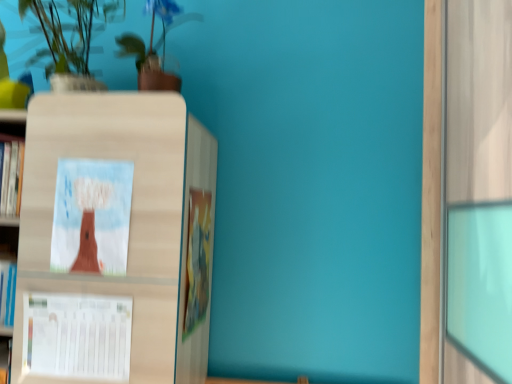
Question: In which direction should I rotate to look at green matte plant at upper center, arranged as the second houseplant when viewed from the left?

Choices:
 (A) right
 (B) left

Answer: (B)

Question: Is green matte plant at upper left, which is counted as the second houseplant, starting from the right, closer to camera compared to green matte plant at upper center, arranged as the second houseplant when viewed from the left?

Choices:
 (A) yes
 (B) no

Answer: (A)

Question: Can you confirm if green matte plant at upper left, the 1th houseplant when ordered from left to right, is bigger than green matte plant at upper center, arranged as the second houseplant when viewed from the left?

Choices:
 (A) no
 (B) yes

Answer: (B)

Question: Does green matte plant at upper left, the 1th houseplant when ordered from left to right, appear on the right side of green matte plant at upper center, arranged as the second houseplant when viewed from the left?

Choices:
 (A) no
 (B) yes

Answer: (A)

Question: Is the surface of green matte plant at upper left, the 1th houseplant when ordered from left to right, in direct contact with green matte plant at upper center, arranged as the second houseplant when viewed from the left?

Choices:
 (A) no
 (B) yes

Answer: (A)

Question: From a real-world perspective, is green matte plant at upper left, the 1th houseplant when ordered from left to right, physically below green matte plant at upper center, arranged as the second houseplant when viewed from the left?

Choices:
 (A) no
 (B) yes

Answer: (B)

Question: Is green matte plant at upper left, the 1th houseplant when ordered from left to right, outside of green matte plant at upper center, which is counted as the 1th houseplant, starting from the right?

Choices:
 (A) no
 (B) yes

Answer: (B)

Question: From the image's perspective, is green matte plant at upper center, which is counted as the 1th houseplant, starting from the right, under green matte plant at upper left, the 1th houseplant when ordered from left to right?

Choices:
 (A) yes
 (B) no

Answer: (A)

Question: Is green matte plant at upper center, which is counted as the 1th houseplant, starting from the right, oriented towards green matte plant at upper left, which is counted as the second houseplant, starting from the right?

Choices:
 (A) yes
 (B) no

Answer: (B)

Question: From a real-world perspective, is green matte plant at upper center, which is counted as the 1th houseplant, starting from the right, below green matte plant at upper left, which is counted as the second houseplant, starting from the right?

Choices:
 (A) no
 (B) yes

Answer: (A)

Question: Would you consider green matte plant at upper center, arranged as the second houseplant when viewed from the left, to be distant from green matte plant at upper left, which is counted as the second houseplant, starting from the right?

Choices:
 (A) no
 (B) yes

Answer: (A)

Question: Does green matte plant at upper center, which is counted as the 1th houseplant, starting from the right, have a larger size compared to green matte plant at upper left, which is counted as the second houseplant, starting from the right?

Choices:
 (A) no
 (B) yes

Answer: (A)

Question: Can you confirm if green matte plant at upper center, which is counted as the 1th houseplant, starting from the right, is wider than green matte plant at upper left, which is counted as the second houseplant, starting from the right?

Choices:
 (A) no
 (B) yes

Answer: (A)

Question: Is green matte plant at upper center, which is counted as the 1th houseplant, starting from the right, further to camera compared to white paper calendar at lower left, marked as the 1th book cover in a bottom-to-top arrangement?

Choices:
 (A) yes
 (B) no

Answer: (A)